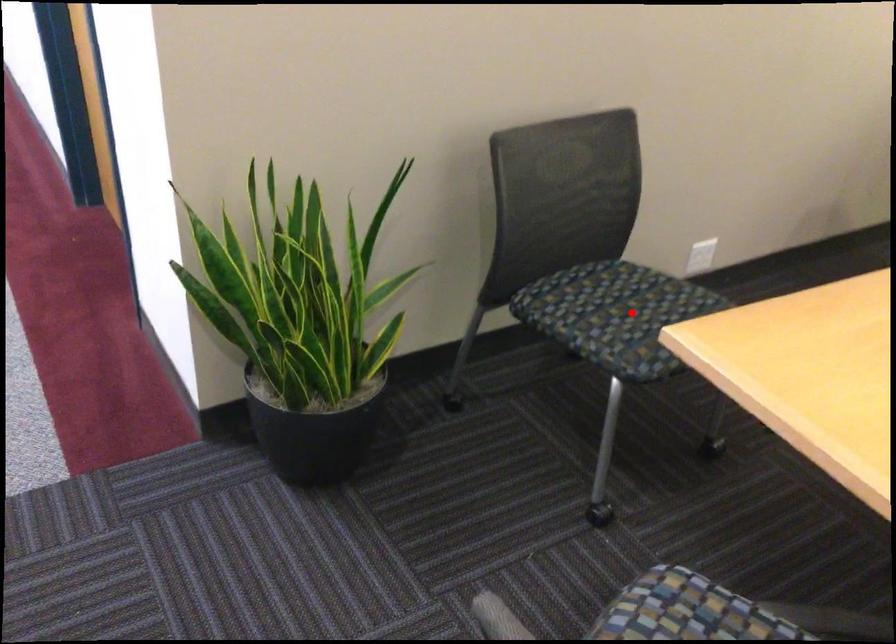
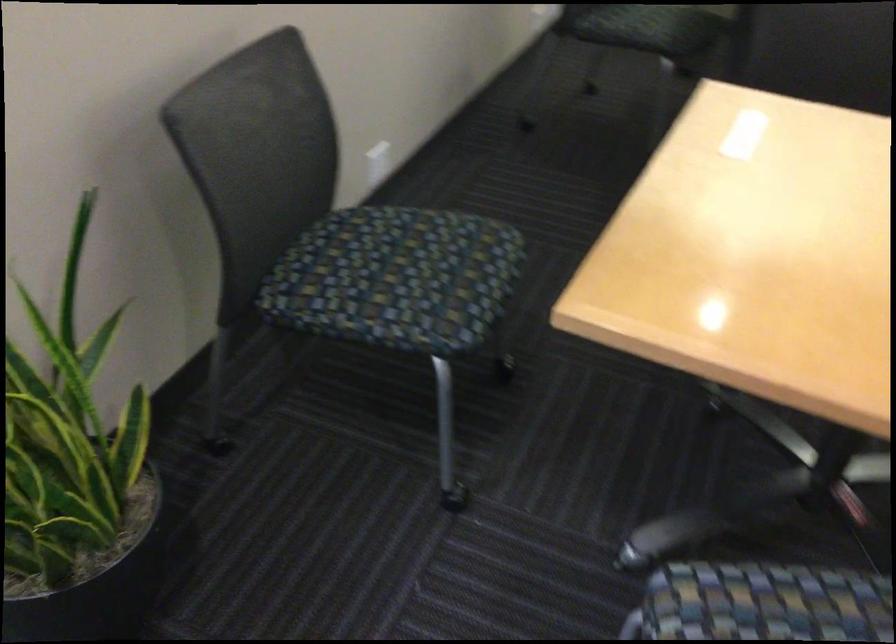
Question: I am providing you with two images of the same scene from different viewpoints. Image1 has a red point marked. In image2, the corresponding 3D location appears at what relative position? Reply with the corresponding letter.

Choices:
 (A) Closer
 (B) Farther

Answer: (A)